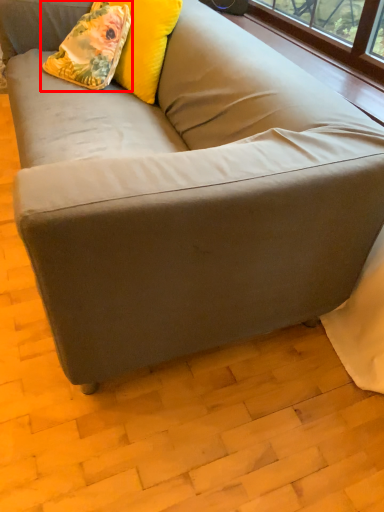
Question: Observing the image, what is the correct spatial positioning of throw pillow (annotated by the red box) in reference to pillow?

Choices:
 (A) left
 (B) right

Answer: (A)